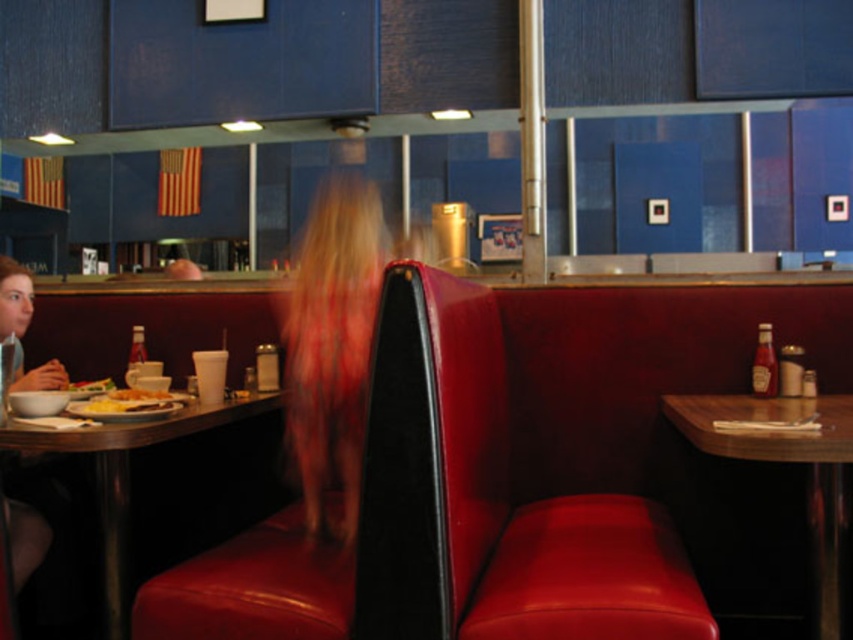
Question: Is the position of matte plastic table at left less distant than that of golden crispy hash browns at left?

Choices:
 (A) no
 (B) yes

Answer: (B)

Question: Does velvet red booth at center have a smaller size compared to blurred blonde hair at center?

Choices:
 (A) no
 (B) yes

Answer: (A)

Question: Which of the following is the closest to the observer?

Choices:
 (A) (778, 416)
 (B) (351, 484)
 (C) (387, 625)
 (D) (222, 403)

Answer: (C)

Question: Does wooden table at right have a lesser width compared to matte plastic table at left?

Choices:
 (A) yes
 (B) no

Answer: (B)

Question: Which of these objects is positioned closest to the velvet red booth at center?

Choices:
 (A) golden crispy hash browns at left
 (B) wooden table at right

Answer: (B)

Question: Among these objects, which one is nearest to the camera?

Choices:
 (A) matte plastic table at left
 (B) wooden table at right

Answer: (B)